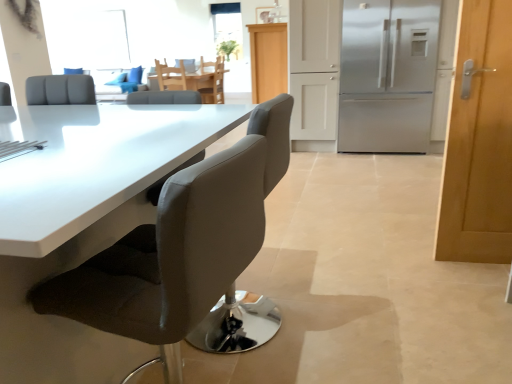
The image size is (512, 384). Identify the location of light wood cabinet at center. (268, 60).

The height and width of the screenshot is (384, 512). In order to click on matte gray chair at center, acting as the 4th chair starting from the top in this screenshot , I will do `click(172, 256)`.

What is the approximate height of wooden round table at center?

wooden round table at center is 30.09 inches in height.

Image resolution: width=512 pixels, height=384 pixels. What do you see at coordinates (388, 75) in the screenshot? I see `satin silver refrigerator at right` at bounding box center [388, 75].

Locate an element on the screen. light wood cabinet at center is located at coordinates (268, 60).

Would you say satin silver refrigerator at right is to the left or to the right of wooden chair at center, the third chair from the bottom, in the picture?

In the image, satin silver refrigerator at right appears on the right side of wooden chair at center, the third chair from the bottom.

You are a GUI agent. You are given a task and a screenshot of the screen. Output one action in this format:
    pyautogui.click(x=<x>, y=<y>)
    Task: Click on the 4th chair to the left when counting from the satin silver refrigerator at right
    
    Given the screenshot: What is the action you would take?
    pyautogui.click(x=170, y=76)

From the picture: Is satin silver refrigerator at right spatially inside wooden chair at center, positioned as the 3th chair in front-to-back order, or outside of it?

satin silver refrigerator at right is located beyond the bounds of wooden chair at center, positioned as the 3th chair in front-to-back order.

Which object is further away from the camera, satin silver refrigerator at right or wooden chair at center, which is the 2th chair in back-to-front order?

wooden chair at center, which is the 2th chair in back-to-front order, is further from the camera.

From the image's perspective, would you say wooden round table at center is shown under wooden door at right?

No.

In the scene shown: Who is taller, wooden round table at center or wooden door at right?

Standing taller between the two is wooden door at right.

How much distance is there between wooden round table at center and wooden door at right?

They are 4.12 meters apart.

Is point (211, 73) more distant than point (508, 69)?

That is True.

Is suede-like gray chair at center, which is the second chair in front-to-back order, inside the boundaries of matte gray chair at center, acting as the 4th chair starting from the top, or outside?

suede-like gray chair at center, which is the second chair in front-to-back order, cannot be found inside matte gray chair at center, acting as the 4th chair starting from the top.

Which is in front, point (208, 344) or point (218, 218)?

The point (218, 218) is more forward.

Is suede-like gray chair at center, acting as the second chair starting from the bottom, facing towards matte gray chair at center, acting as the 4th chair starting from the top?

No, suede-like gray chair at center, acting as the second chair starting from the bottom, is not facing towards matte gray chair at center, acting as the 4th chair starting from the top.

Which object is further away from the camera taking this photo, suede-like gray chair at center, which is the second chair in front-to-back order, or matte gray chair at center, positioned as the fourth chair in back-to-front order?

suede-like gray chair at center, which is the second chair in front-to-back order, is further away from the camera.

In terms of size, does wooden chair at center, the third chair from the bottom, appear bigger or smaller than suede-like gray chair at center, which is counted as the third chair, starting from the back?

wooden chair at center, the third chair from the bottom, is smaller than suede-like gray chair at center, which is counted as the third chair, starting from the back.

Choose the correct answer: Is wooden chair at center, the 2th chair in the top-to-bottom sequence, inside suede-like gray chair at center, which is the 3th chair in top-to-bottom order, or outside it?

wooden chair at center, the 2th chair in the top-to-bottom sequence, lies outside suede-like gray chair at center, which is the 3th chair in top-to-bottom order.

Consider the image. Which object is further away from the camera taking this photo, wooden chair at center, the third chair from the bottom, or suede-like gray chair at center, which is counted as the third chair, starting from the back?

wooden chair at center, the third chair from the bottom, is further from the camera.

Can you confirm if matte gray chair at center, acting as the 4th chair starting from the top, is shorter than light brown wooden chair at center, the 4th chair in the front-to-back sequence?

Incorrect, the height of matte gray chair at center, acting as the 4th chair starting from the top, does not fall short of that of light brown wooden chair at center, the 4th chair in the front-to-back sequence.

Relative to light brown wooden chair at center, acting as the fourth chair starting from the bottom, is matte gray chair at center, the 1th chair in the bottom-to-top sequence, in front or behind?

matte gray chair at center, the 1th chair in the bottom-to-top sequence, is positioned closer to the viewer than light brown wooden chair at center, acting as the fourth chair starting from the bottom.

Considering the positions of point (243, 229) and point (203, 92), is point (243, 229) closer or farther from the camera than point (203, 92)?

Point (243, 229) is positioned closer to the camera compared to point (203, 92).

How different are the orientations of matte gray chair at center, which is the 1th chair in front-to-back order, and light brown wooden chair at center, the 1th chair in the top-to-bottom sequence, in degrees?

matte gray chair at center, which is the 1th chair in front-to-back order, and light brown wooden chair at center, the 1th chair in the top-to-bottom sequence, are facing 10.1 degrees away from each other.

Consider the image. Is matte gray chair at center, the 1th chair in the bottom-to-top sequence, positioned with its back to light wood cabinet at center?

matte gray chair at center, the 1th chair in the bottom-to-top sequence, is not turned away from light wood cabinet at center.

Considering the sizes of objects matte gray chair at center, acting as the 4th chair starting from the top, and light wood cabinet at center in the image provided, who is taller, matte gray chair at center, acting as the 4th chair starting from the top, or light wood cabinet at center?

light wood cabinet at center.

From the image's perspective, does matte gray chair at center, positioned as the fourth chair in back-to-front order, appear lower than light wood cabinet at center?

Yes.

Considering the positions of point (185, 309) and point (278, 82), is point (185, 309) closer or farther from the camera than point (278, 82)?

Point (185, 309) is positioned closer to the camera compared to point (278, 82).

Is satin silver refrigerator at right positioned far away from wooden door at right?

satin silver refrigerator at right is far away from wooden door at right.

What's the angular difference between satin silver refrigerator at right and wooden door at right's facing directions?

They differ by 180 degrees in their facing directions.

Is satin silver refrigerator at right inside or outside of wooden door at right?

satin silver refrigerator at right is not enclosed by wooden door at right.

Who is shorter, satin silver refrigerator at right or wooden door at right?

wooden door at right is shorter.

At what (x,y) coordinates should I click in order to perform the action: click on refrigerator in front of the wooden chair at center, the third chair from the bottom. Please return your answer as a coordinate pair (x, y). The width and height of the screenshot is (512, 384). Looking at the image, I should click on (388, 75).

The width and height of the screenshot is (512, 384). Identify the location of round table lying above the wooden door at right (from the image's perspective). (202, 84).

Looking at the image, which one is located further to clear glass window at upper center, suede-like gray chair at center, which is counted as the third chair, starting from the back, or wooden round table at center?

Based on the image, suede-like gray chair at center, which is counted as the third chair, starting from the back, appears to be further to clear glass window at upper center.

When comparing their distances from wooden round table at center, does matte gray chair at center, the 1th chair in the bottom-to-top sequence, or wooden chair at center, which is the 2th chair in back-to-front order, seem further?

The object further to wooden round table at center is matte gray chair at center, the 1th chair in the bottom-to-top sequence.

Which object lies nearer to the anchor point wooden round table at center, satin silver refrigerator at right or light wood cabinet at center?

light wood cabinet at center lies closer to wooden round table at center than the other object.

Based on their spatial positions, is suede-like gray chair at center, acting as the second chair starting from the bottom, or wooden door at right further from wooden round table at center?

Among the two, suede-like gray chair at center, acting as the second chair starting from the bottom, is located further to wooden round table at center.

Estimate the real-world distances between objects in this image. Which object is closer to matte gray chair at center, positioned as the fourth chair in back-to-front order, wooden chair at center, the 2th chair in the top-to-bottom sequence, or suede-like gray chair at center, which is the 3th chair in top-to-bottom order?

suede-like gray chair at center, which is the 3th chair in top-to-bottom order, is positioned closer to the anchor matte gray chair at center, positioned as the fourth chair in back-to-front order.

Looking at the image, which one is located further to matte gray chair at center, which is the 1th chair in front-to-back order, light wood cabinet at center or wooden round table at center?

wooden round table at center is further to matte gray chair at center, which is the 1th chair in front-to-back order.

Estimate the real-world distances between objects in this image. Which object is closer to clear glass window at upper center, wooden chair at center, which is the 2th chair in back-to-front order, or satin silver refrigerator at right?

wooden chair at center, which is the 2th chair in back-to-front order, is positioned closer to the anchor clear glass window at upper center.

Looking at the image, which one is located further to suede-like gray chair at center, acting as the second chair starting from the bottom, light brown wooden chair at center, the 4th chair in the front-to-back sequence, or matte gray chair at center, the 1th chair in the bottom-to-top sequence?

The object further to suede-like gray chair at center, acting as the second chair starting from the bottom, is light brown wooden chair at center, the 4th chair in the front-to-back sequence.

I want to click on round table between satin silver refrigerator at right and light brown wooden chair at center, acting as the fourth chair starting from the bottom, from front to back, so click(202, 84).

You are a GUI agent. You are given a task and a screenshot of the screen. Output one action in this format:
    pyautogui.click(x=<x>, y=<y>)
    Task: Click on the cabinetry positioned between matte gray chair at center, the 1th chair in the bottom-to-top sequence, and wooden chair at center, the 2th chair in the top-to-bottom sequence, from near to far
    
    Given the screenshot: What is the action you would take?
    pyautogui.click(x=268, y=60)

Identify the location of chair positioned between matte gray chair at center, positioned as the fourth chair in back-to-front order, and wooden chair at center, positioned as the 3th chair in front-to-back order, from near to far. (236, 324).

Where is `chair located between suede-like gray chair at center, which is the 3th chair in top-to-bottom order, and wooden round table at center in the depth direction`? chair located between suede-like gray chair at center, which is the 3th chair in top-to-bottom order, and wooden round table at center in the depth direction is located at coordinates (170, 76).